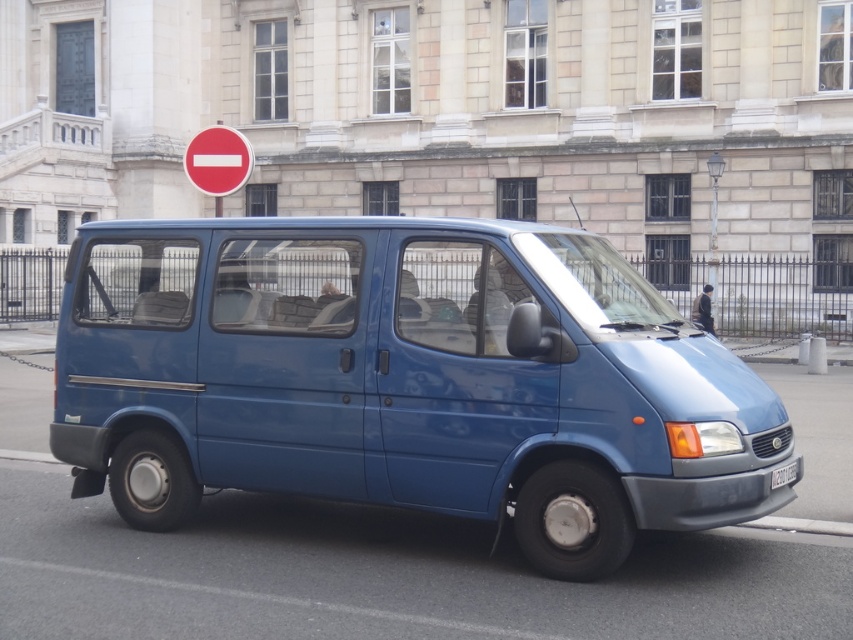
You are a delivery driver who needs to park your blue matte van at center in a parking spot that is exactly the same width as the black plastic license plate at center. Will the van fit in the parking spot?

The blue matte van at center is wider than the black plastic license plate at center, so it will not fit in the parking spot designed for the license plate width.

You are a delivery driver who needs to park your vehicle in a way that ensures the red matte sign at upper center and the black plastic license plate at center are both visible from the front. Which part of the vehicle should you avoid covering with any cargo?

A: The red matte sign at upper center is located above the black plastic license plate at center. To ensure both are visible, avoid placing cargo over the front area of the vehicle where the license plate is mounted, particularly the upper section near the windshield or above the bumper where the sign is positioned.

You are a delivery driver who needs to ensure your blue matte van at center can fit into a parking spot that is exactly the size of the black plastic license plate at center. Based on the scene, can your van fit into this parking spot?

The blue matte van at center is larger in size than the black plastic license plate at center, so the van cannot fit into a parking spot that is exactly the size of the license plate.